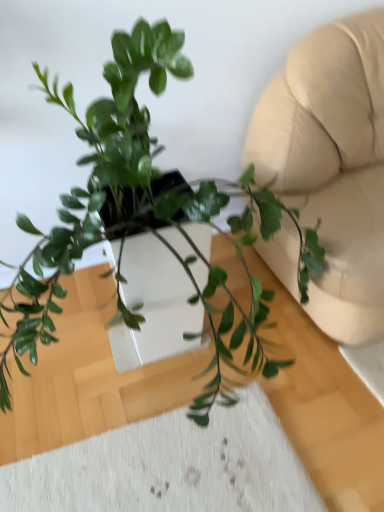
Where is `green glossy plant at center`? green glossy plant at center is located at coordinates (137, 207).

What do you see at coordinates (137, 207) in the screenshot? The height and width of the screenshot is (512, 384). I see `green glossy plant at center` at bounding box center [137, 207].

Find the location of a particular element. green glossy plant at center is located at coordinates (137, 207).